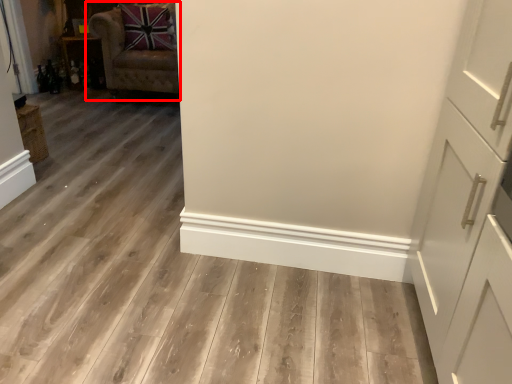
Question: From the image's perspective, considering the relative positions of chair (annotated by the red box) and cabinetry in the image provided, where is chair (annotated by the red box) located with respect to the staircase?

Choices:
 (A) below
 (B) above

Answer: (A)